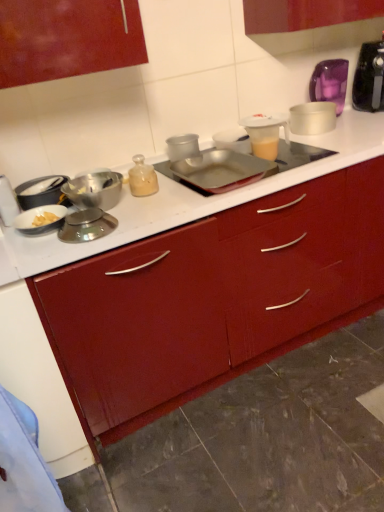
Identify the location of space that is in front of translucent glass bottle at center. (158, 207).